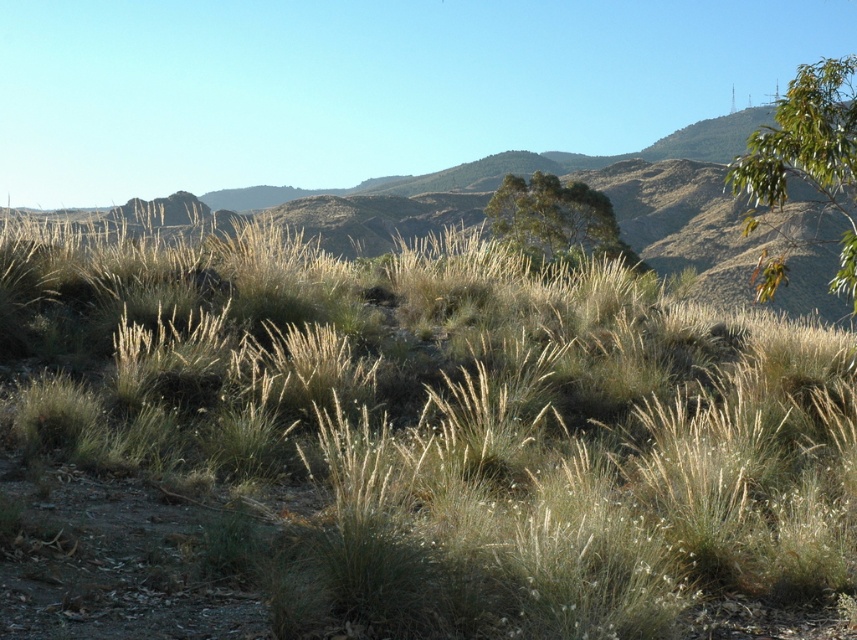
Does dry grass at center have a lesser width compared to green leafy tree at upper right?

Yes, dry grass at center is thinner than green leafy tree at upper right.

Between dry grass at center and green leafy tree at upper right, which one appears on the right side from the viewer's perspective?

From the viewer's perspective, green leafy tree at upper right appears more on the right side.

Where is `dry grass at center`? This screenshot has height=640, width=857. dry grass at center is located at coordinates (440, 426).

At what (x,y) coordinates should I click in order to perform the action: click on dry grass at center. Please return your answer as a coordinate pair (x, y). The width and height of the screenshot is (857, 640). Looking at the image, I should click on (440, 426).

Is dry grass at center positioned before green leafy tree at upper center?

Yes, dry grass at center is in front of green leafy tree at upper center.

Is point (476, 490) farther from viewer compared to point (560, 205)?

No, it is in front of (560, 205).

In order to click on dry grass at center in this screenshot , I will do `click(440, 426)`.

Between green leafy tree at upper right and green leafy tree at upper center, which one has less height?

Standing shorter between the two is green leafy tree at upper center.

Between point (750, 134) and point (507, 188), which one is positioned in front?

Point (507, 188) is more forward.

I want to click on green leafy tree at upper right, so click(x=808, y=154).